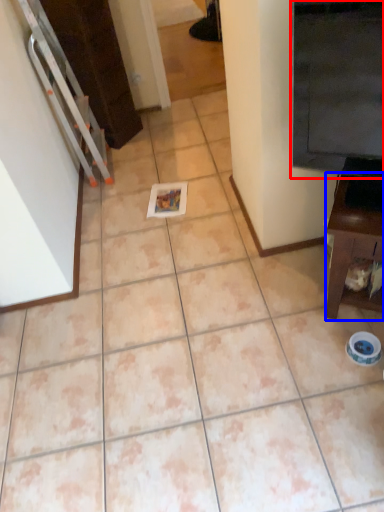
Question: Among these objects, which one is farthest to the camera, fridge (highlighted by a red box) or furniture (highlighted by a blue box)?

Choices:
 (A) fridge
 (B) furniture

Answer: (B)